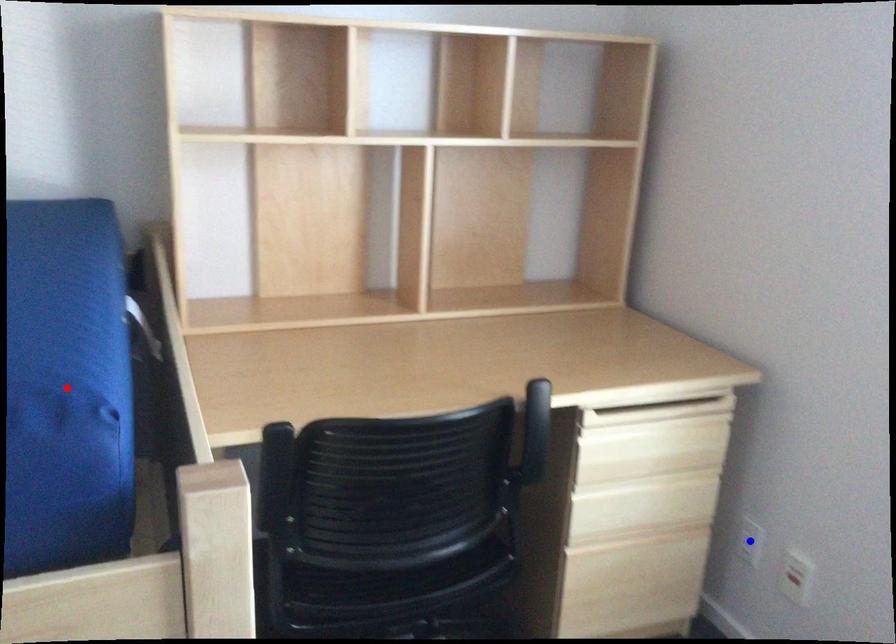
Question: Which of the two points in the image is closer to the camera?

Choices:
 (A) Blue point is closer.
 (B) Red point is closer.

Answer: (B)